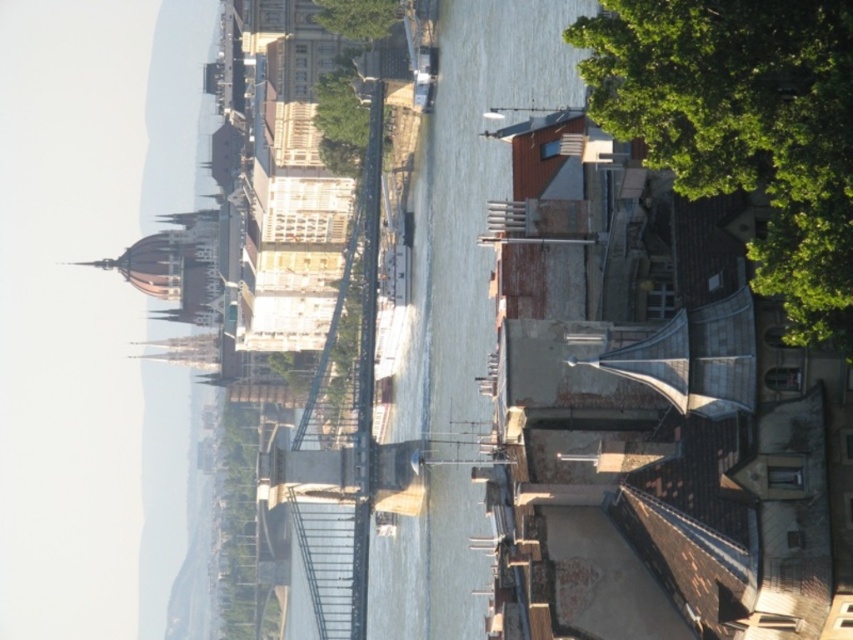
You are a tourist standing in the city and want to take a photo of the clear water at center and the green leafy tree at upper center. Based on their positions, which object would appear closer to the camera in your photo?

The clear water at center appears closer to the camera because it is positioned under the green leafy tree at upper center, indicating it is lower in the scene.

You are a photographer planning to capture the entire scene in one shot. Considering the clear water at center and the green leafy tree at upper right, which object should you focus on first to ensure both are in sharp focus?

The green leafy tree at upper right should be focused on first because it is closer to the camera than the clear water at center, ensuring both will be in focus when using depth of field techniques.